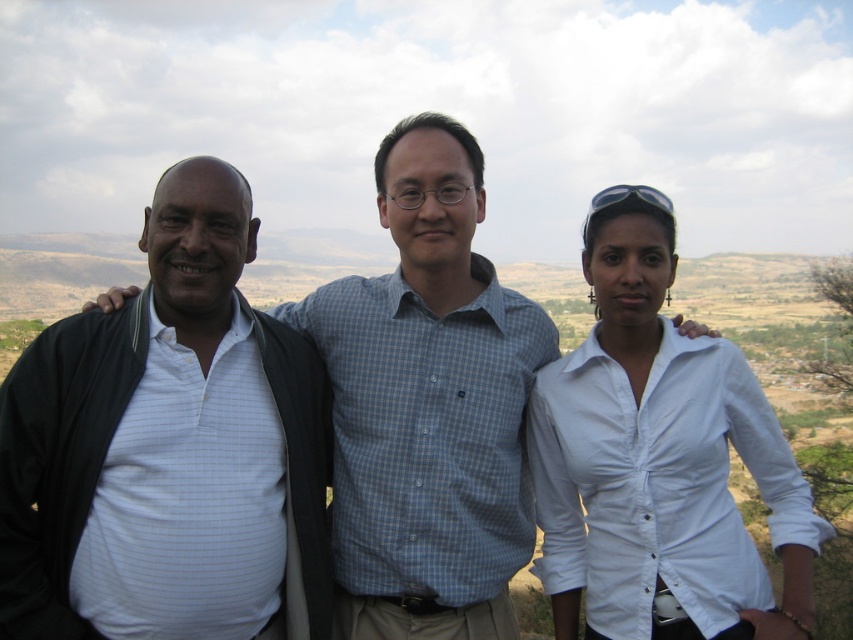
In the scene shown: You are a photographer taking a group photo of the white shirt at center and the white striped shirt at left. If you want to ensure both subjects are in focus, which one should you adjust the camera focus to prioritize based on their positions?

The white striped shirt at left is behind the white shirt at center, so to ensure both are in focus, the photographer should focus on the white shirt at center since it is closer to the camera and adjust the depth of field accordingly.